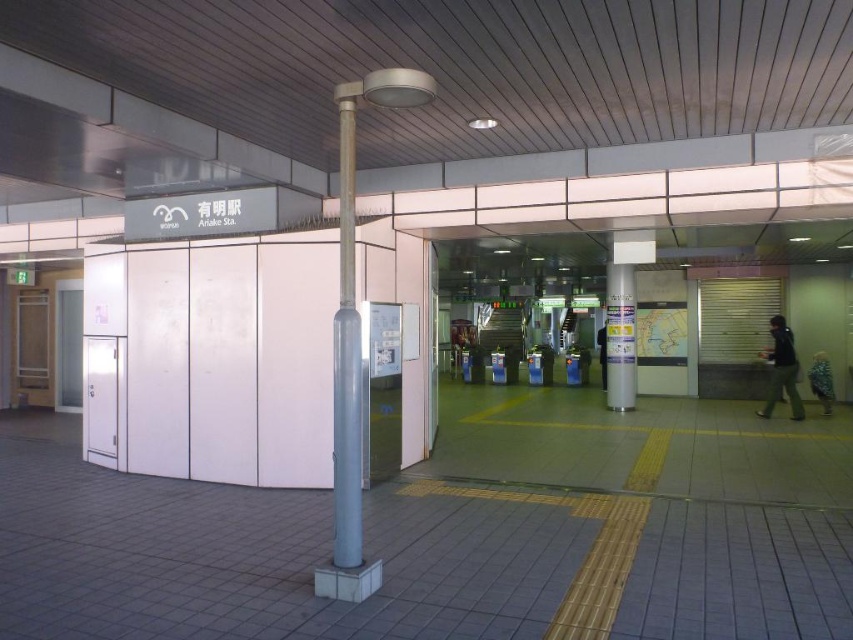
Question: Does dark gray fabric jacket at right appear on the right side of blue patterned shirt at right?

Choices:
 (A) yes
 (B) no

Answer: (B)

Question: Considering the relative positions of white glossy pillar at center and blue patterned shirt at right in the image provided, where is white glossy pillar at center located with respect to blue patterned shirt at right?

Choices:
 (A) right
 (B) left

Answer: (B)

Question: Among these objects, which one is nearest to the camera?

Choices:
 (A) dark gray fabric jacket at right
 (B) blue patterned shirt at right

Answer: (A)

Question: Which point is farther to the camera?

Choices:
 (A) blue patterned shirt at right
 (B) white glossy pillar at center

Answer: (B)

Question: Which point is farther to the camera?

Choices:
 (A) blue patterned shirt at right
 (B) dark gray fabric jacket at right

Answer: (A)

Question: Is white glossy pillar at center bigger than dark gray fabric jacket at right?

Choices:
 (A) yes
 (B) no

Answer: (A)